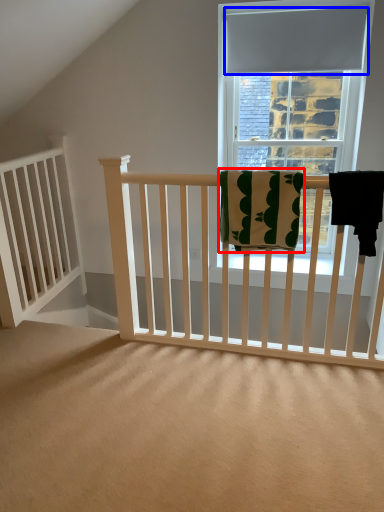
Question: Which of the following is the closest to the observer, beach towel (highlighted by a red box) or curtain (highlighted by a blue box)?

Choices:
 (A) beach towel
 (B) curtain

Answer: (A)